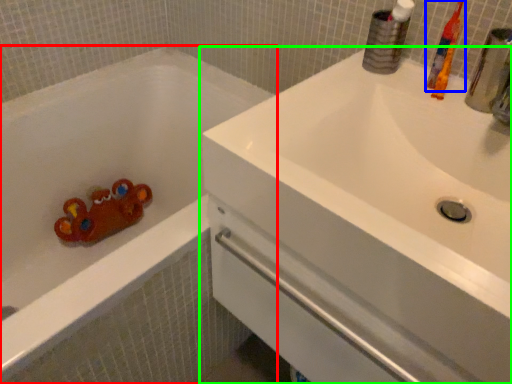
Question: Which is farther away from bathtub (highlighted by a red box)? toothbrush (highlighted by a blue box) or sink (highlighted by a green box)?

Choices:
 (A) toothbrush
 (B) sink

Answer: (A)